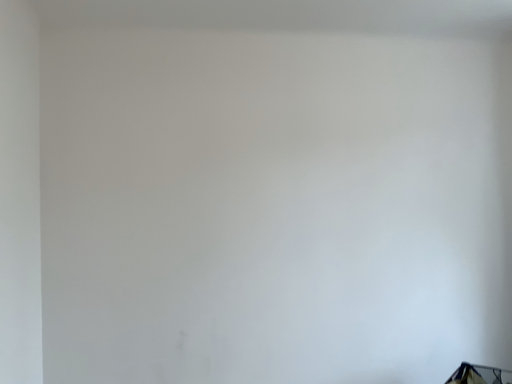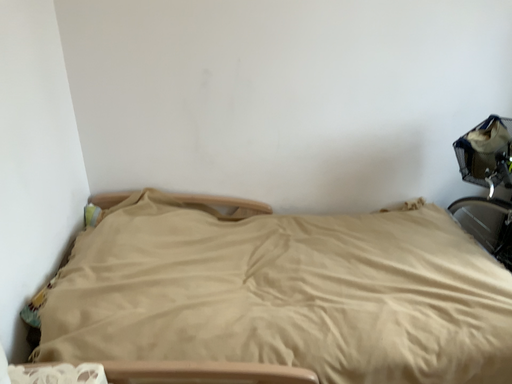
Question: How did the camera likely rotate when shooting the video?

Choices:
 (A) rotated downward
 (B) rotated upward

Answer: (A)